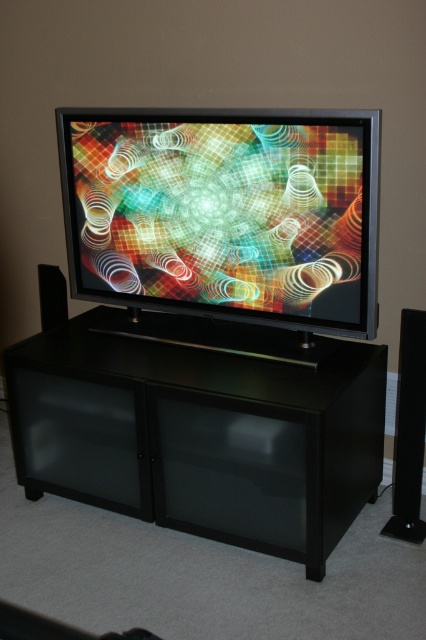
Question: Which point is closer to the camera?

Choices:
 (A) (350, 508)
 (B) (422, 456)
 (C) (123, 227)
 (D) (40, 305)

Answer: (A)

Question: Is the position of black matte entertainment center at center more distant than that of black matte speaker at left?

Choices:
 (A) no
 (B) yes

Answer: (A)

Question: Considering the relative positions of black matte entertainment center at center and black matte speaker at left in the image provided, where is black matte entertainment center at center located with respect to black matte speaker at left?

Choices:
 (A) above
 (B) below

Answer: (B)

Question: Which point appears farthest from the camera in this image?

Choices:
 (A) tap(328, 244)
 (B) tap(420, 333)
 (C) tap(40, 284)

Answer: (C)

Question: Which of the following is the closest to the observer?

Choices:
 (A) (255, 458)
 (B) (402, 365)
 (C) (63, 289)

Answer: (A)

Question: Does black matte entertainment center at center have a larger size compared to black plastic speaker at right?

Choices:
 (A) no
 (B) yes

Answer: (B)